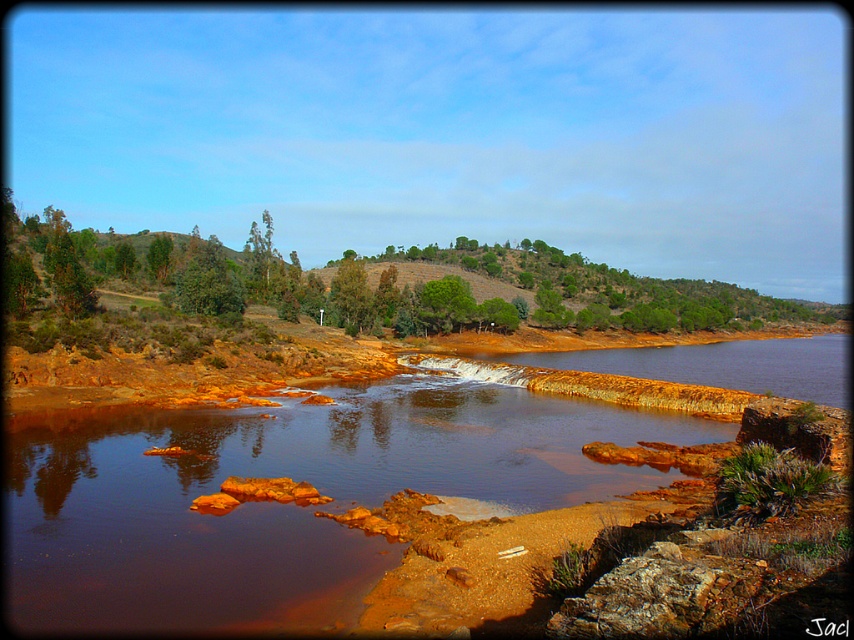
Question: Is brown rock at center further to the viewer compared to green matte tree at center?

Choices:
 (A) no
 (B) yes

Answer: (A)

Question: Is brown sedimentary rock at center behind green matte tree at center?

Choices:
 (A) yes
 (B) no

Answer: (B)

Question: Among these points, which one is nearest to the camera?

Choices:
 (A) (703, 352)
 (B) (348, 317)

Answer: (B)

Question: Estimate the real-world distances between objects in this image. Which object is closer to the brown rock at center?

Choices:
 (A) brown sedimentary rock at center
 (B) green matte tree at center

Answer: (A)

Question: Which is farther from the green matte tree at center?

Choices:
 (A) brown rock at center
 (B) brown sedimentary rock at center

Answer: (B)

Question: Is brown sedimentary rock at center further to the viewer compared to green matte tree at center?

Choices:
 (A) no
 (B) yes

Answer: (A)